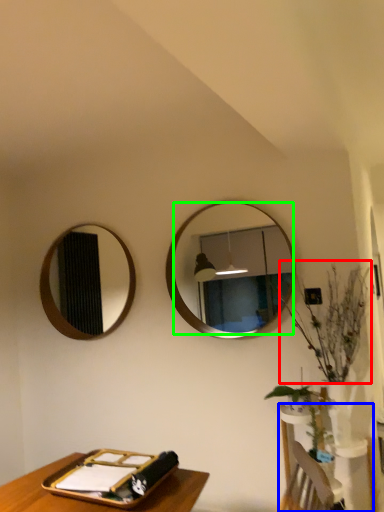
Question: Estimate the real-world distances between objects in this image. Which object is closer to floral arrangement (highlighted by a red box), vanity (highlighted by a blue box) or mirror (highlighted by a green box)?

Choices:
 (A) vanity
 (B) mirror

Answer: (B)